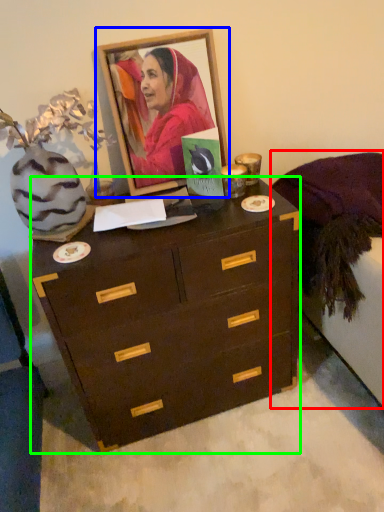
Question: Which object is the closest to the bed frame (highlighted by a red box)? Choose among these: picture frame (highlighted by a blue box) or chest of drawers (highlighted by a green box).

Choices:
 (A) picture frame
 (B) chest of drawers

Answer: (B)